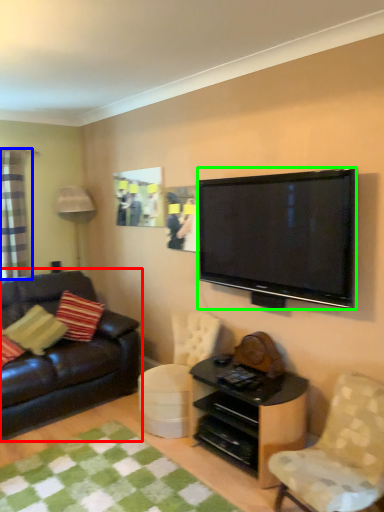
Question: Estimate the real-world distances between objects in this image. Which object is closer to studio couch (highlighted by a red box), curtain (highlighted by a blue box) or television (highlighted by a green box)?

Choices:
 (A) curtain
 (B) television

Answer: (A)